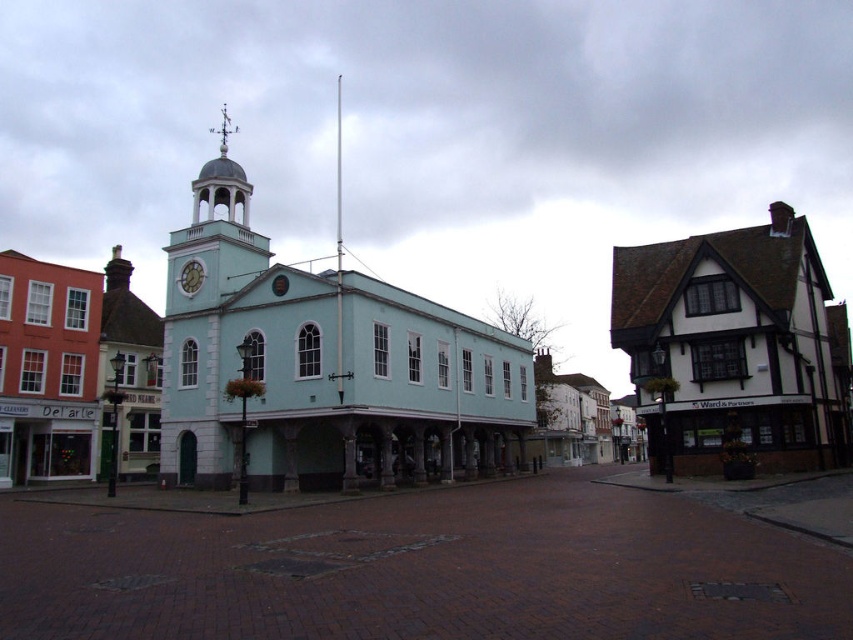
You are standing in the town square and want to place a small flower pot between the brick pavement at center and the teal painted clock at center. Based on their positions, which object should the flower pot be placed in front of or behind?

The brick pavement at center is closer to the viewer than the teal painted clock at center, so the flower pot should be placed behind the brick pavement at center and in front of the teal painted clock at center to maintain the spatial relationship.

Based on the scene description provided, what color is the material at the point labeled as point (323, 365)?

The light blue painted wood at center is represented by point (323, 365), so the color is light blue.

You are standing in the town square and want to place a small flowerpot between the brick pavement at center and the teal painted clock at center. Based on their positions, where should you place the flowerpot to ensure it is between them?

The brick pavement at center is to the right of the teal painted clock at center, so place the flowerpot to the right of the teal painted clock at center but before reaching the brick pavement at center.